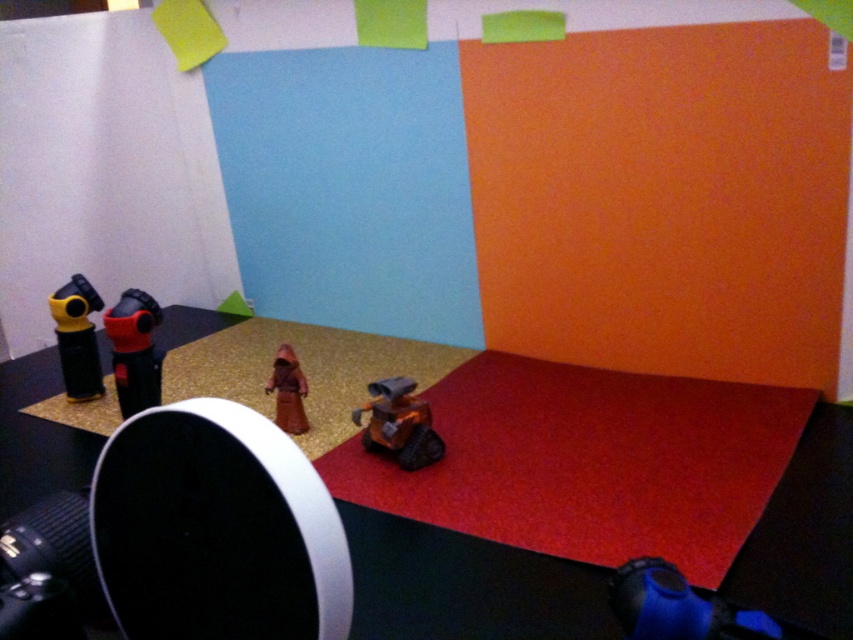
You are setting up a photo shoot and have two cameras, the matte black camera at left and the yellow plastic camera at left. Which camera should you choose if you need a larger one for better quality?

The matte black camera at left is larger in size than the yellow plastic camera at left, so you should choose the matte black camera at left for better quality.

You are setting up a camera for a photo shoot and need to place a prop exactly at the center of the gold textured carpet at center. According to the coordinates provided, where should you position the prop?

The gold textured carpet at center is located at point (451, 177), so you should position the prop at those coordinates to place it exactly at the center.